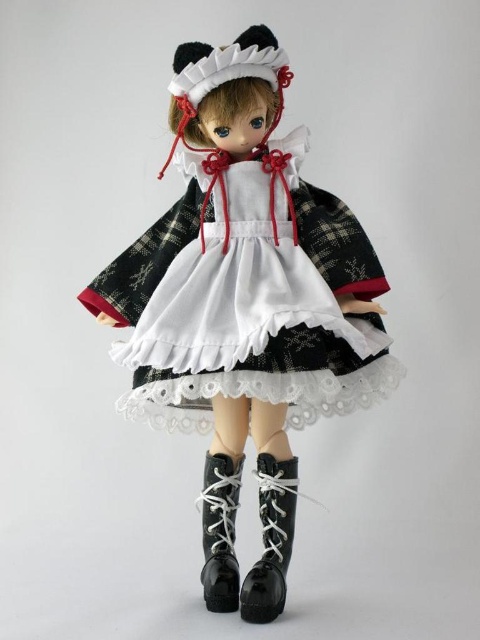
Who is shorter, black rubber boot at lower center or black leather boot at center?

black leather boot at center is shorter.

Where is `black rubber boot at lower center`? black rubber boot at lower center is located at coordinates (272, 540).

This screenshot has height=640, width=480. I want to click on black rubber boot at lower center, so click(x=272, y=540).

Between matte black dress at center and black leather boot at center, which one appears on the right side from the viewer's perspective?

Positioned to the right is matte black dress at center.

Identify the location of matte black dress at center. The height and width of the screenshot is (640, 480). (247, 291).

Where is `matte black dress at center`? The width and height of the screenshot is (480, 640). matte black dress at center is located at coordinates (247, 291).

Where is `matte black dress at center`? Image resolution: width=480 pixels, height=640 pixels. matte black dress at center is located at coordinates (247, 291).